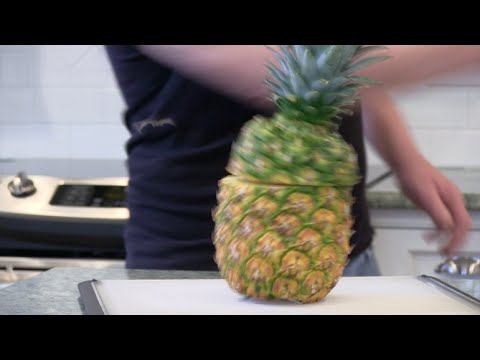
Locate an element on the screen. stove is located at coordinates (79, 166).